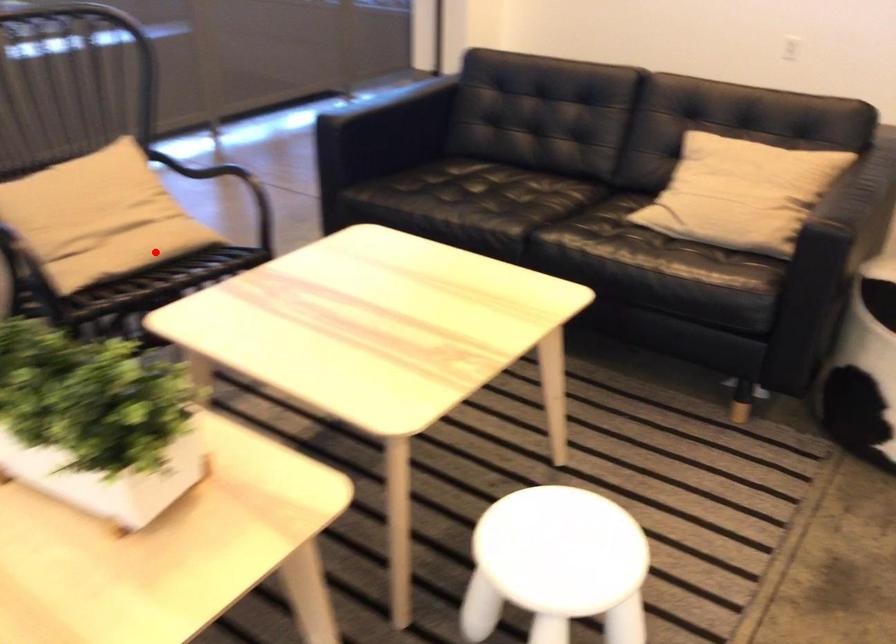
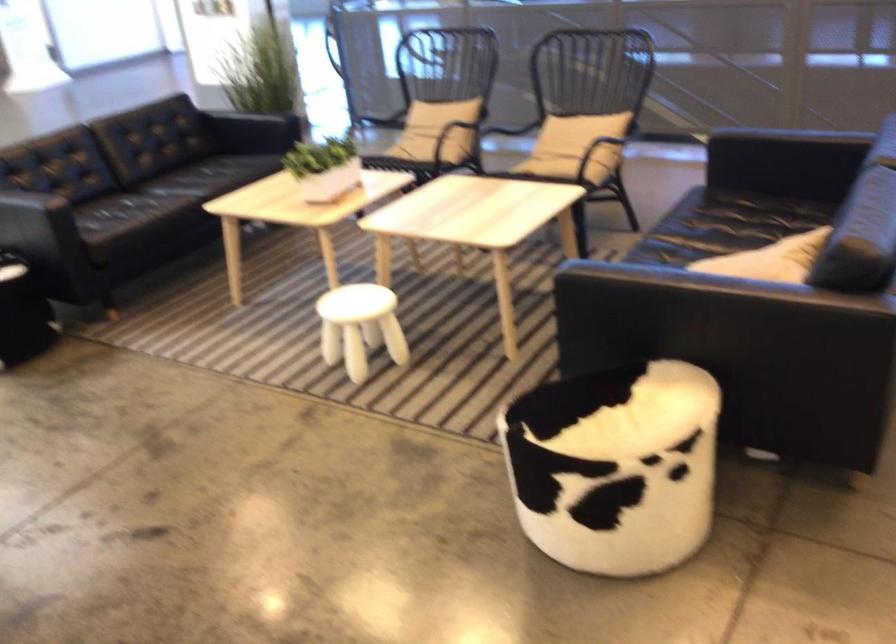
In the second image, find the point that corresponds to the highlighted location in the first image.

(552, 160)